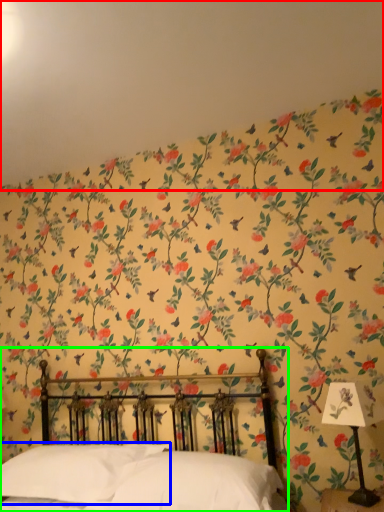
Question: Which object is positioned closest to backdrop (highlighted by a red box)? Select from pillow (highlighted by a blue box) and bed (highlighted by a green box).

Choices:
 (A) pillow
 (B) bed

Answer: (B)